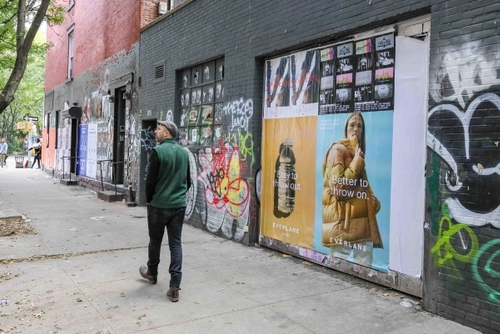
I want to click on purple door, so click(x=79, y=165).